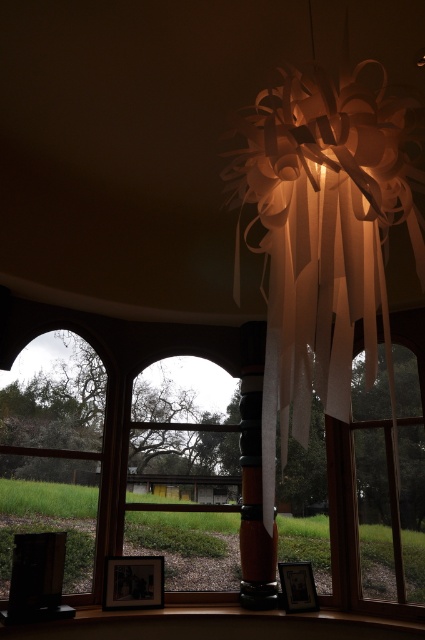
Can you confirm if clear glass window at center is positioned above matte black picture frame at lower center?

Indeed, clear glass window at center is positioned over matte black picture frame at lower center.

Does point (360, 387) lie in front of point (297, 582)?

No, (360, 387) is further to viewer.

Who is more distant from viewer, (x=385, y=429) or (x=297, y=593)?

Positioned behind is point (x=385, y=429).

The image size is (425, 640). Identify the location of clear glass window at center. (390, 480).

Does clear glass window at center come behind matte black picture frame at lower left?

That is False.

Find the location of a particular element. This screenshot has height=640, width=425. clear glass window at center is located at coordinates (390, 480).

Locate an element on the screen. The height and width of the screenshot is (640, 425). clear glass window at center is located at coordinates (390, 480).

Between matte black picture frame at lower left and matte black picture frame at lower center, which one appears on the right side from the viewer's perspective?

Positioned to the right is matte black picture frame at lower center.

At what (x,y) coordinates should I click in order to perform the action: click on matte black picture frame at lower left. Please return your answer as a coordinate pair (x, y). Image resolution: width=425 pixels, height=640 pixels. Looking at the image, I should click on (133, 582).

Identify the location of matte black picture frame at lower left. (133, 582).